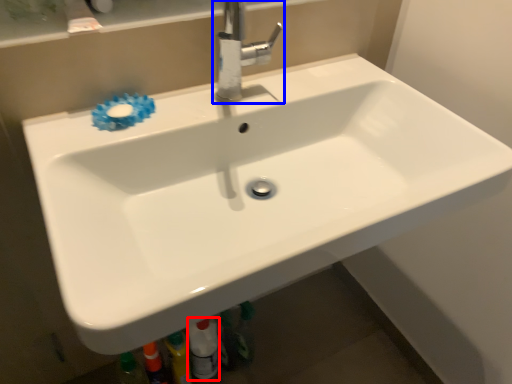
Question: Among these objects, which one is farthest to the camera, toiletry (highlighted by a red box) or tap (highlighted by a blue box)?

Choices:
 (A) toiletry
 (B) tap

Answer: (A)